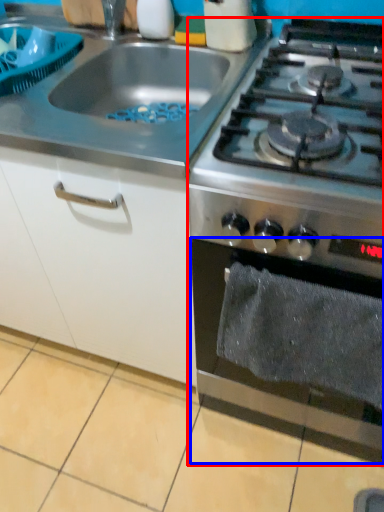
Question: Which of the following is the closest to the observer, gas stove (highlighted by a red box) or oven (highlighted by a blue box)?

Choices:
 (A) gas stove
 (B) oven

Answer: (B)